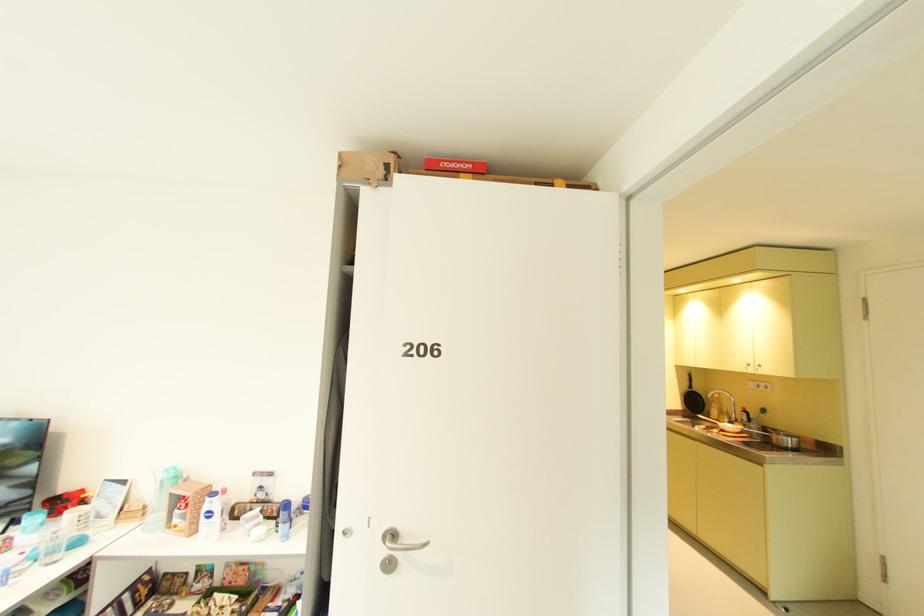
Locate an element on the screen. The image size is (924, 616). black pan handle is located at coordinates (689, 379).